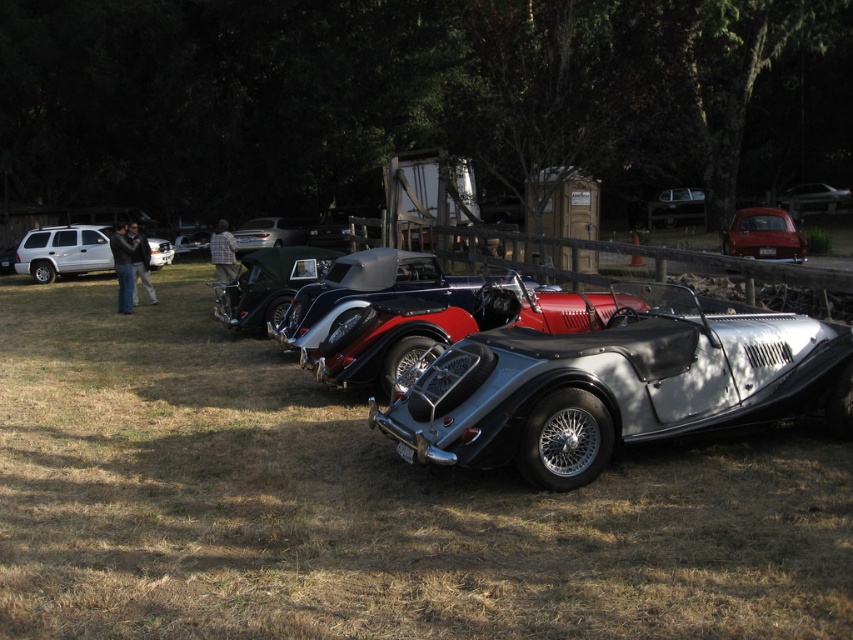
You are a photographer planning to take a photo of the car show. You want to ensure that both the brown dry grass at center and the silver metallic suv at left are visible in the frame. Based on their positions, which object should be placed closer to the left side of the photo?

→ The silver metallic suv at left should be placed closer to the left side of the photo since it is positioned to the left of the brown dry grass at center.

You are standing at the point marked by the coordinates point (62, 252) in the image. Which direction should you walk to reach the silver metallic suv at left?

The point (62, 252) indicates the silver metallic suv at left, so you are already at the silver metallic suv at left.